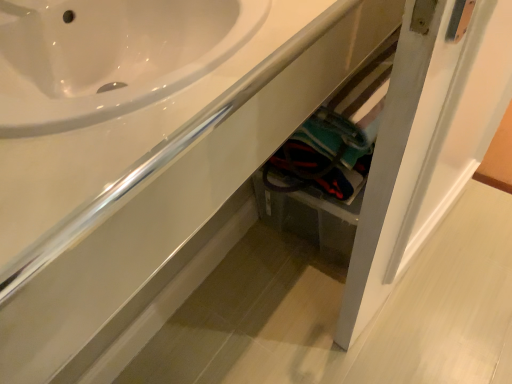
Where is `free spot in front of white glossy door at lower right`? The image size is (512, 384). free spot in front of white glossy door at lower right is located at coordinates (438, 322).